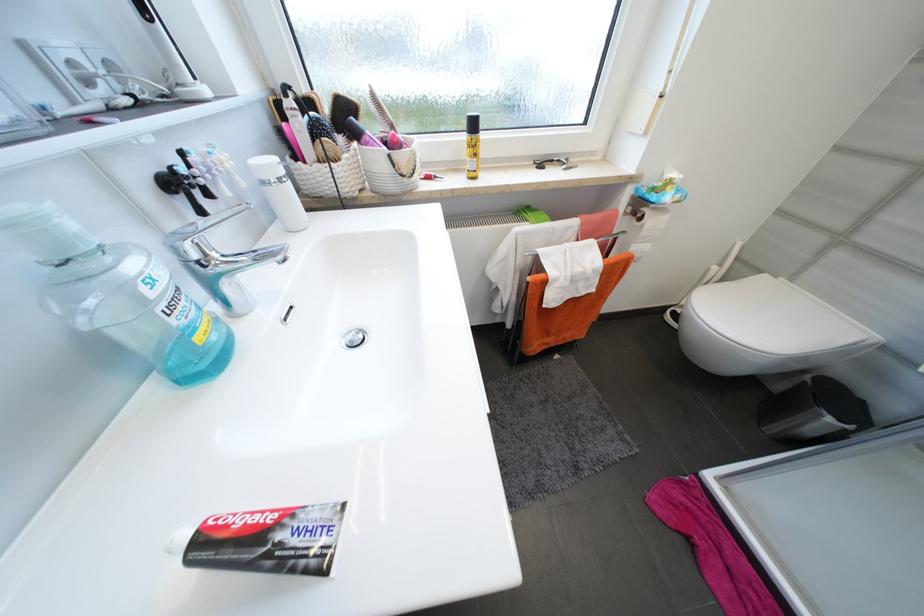
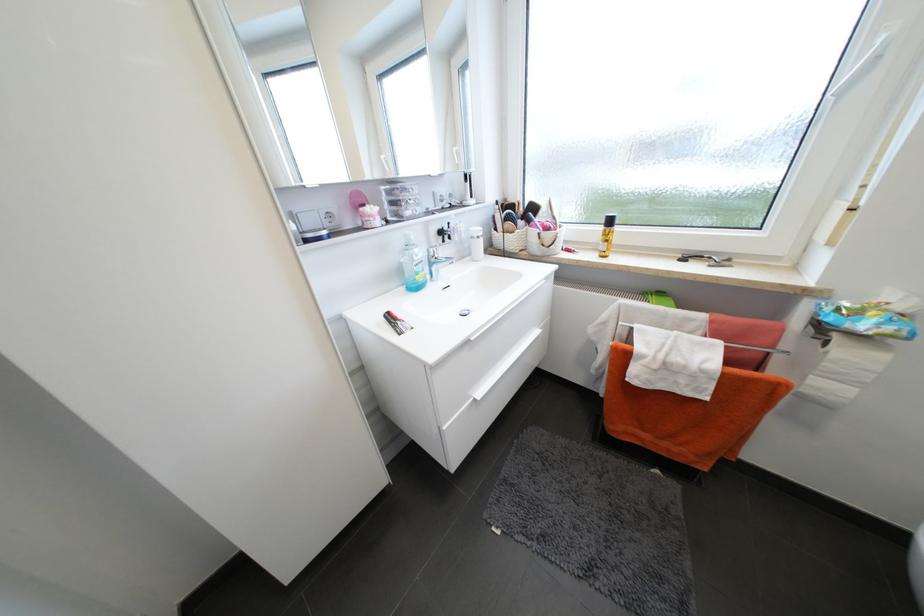
Where in the second image is the point corresponding to (x=395, y=156) from the first image?

(544, 235)